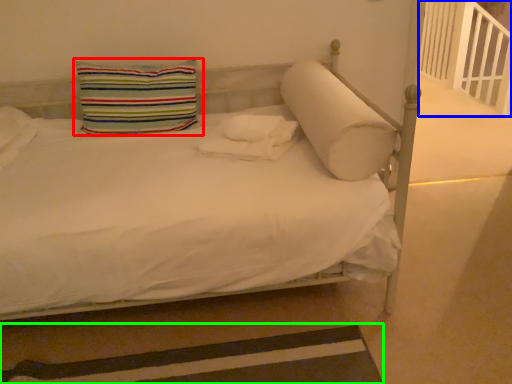
Question: Which is farther away from pillow (highlighted by a red box)? balustrade (highlighted by a blue box) or strip (highlighted by a green box)?

Choices:
 (A) balustrade
 (B) strip

Answer: (A)